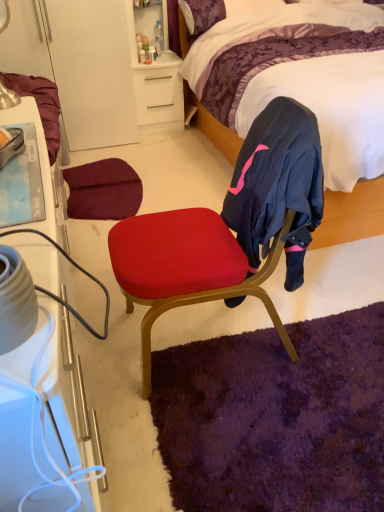
Question: Can you confirm if velvet red chair at center is thinner than white matte desk at upper center?

Choices:
 (A) yes
 (B) no

Answer: (B)

Question: Is velvet red chair at center positioned before white matte desk at upper center?

Choices:
 (A) yes
 (B) no

Answer: (A)

Question: Can you confirm if velvet red chair at center is bigger than white matte desk at upper center?

Choices:
 (A) no
 (B) yes

Answer: (B)

Question: Is velvet red chair at center smaller than white matte desk at upper center?

Choices:
 (A) no
 (B) yes

Answer: (A)

Question: Is white matte desk at upper center located within velvet red chair at center?

Choices:
 (A) yes
 (B) no

Answer: (B)

Question: Considering the positions of white plastic cabinet at left and brushed metal table lamp at upper left in the image, is white plastic cabinet at left taller or shorter than brushed metal table lamp at upper left?

Choices:
 (A) short
 (B) tall

Answer: (B)

Question: From the image's perspective, is white plastic cabinet at left located above or below brushed metal table lamp at upper left?

Choices:
 (A) below
 (B) above

Answer: (A)

Question: Would you say white plastic cabinet at left is to the left or to the right of brushed metal table lamp at upper left in the picture?

Choices:
 (A) right
 (B) left

Answer: (A)

Question: Based on their sizes in the image, would you say white plastic cabinet at left is bigger or smaller than brushed metal table lamp at upper left?

Choices:
 (A) small
 (B) big

Answer: (B)

Question: Looking at their shapes, would you say purple shag rug at lower center is wider or thinner than white plastic cabinet at left?

Choices:
 (A) thin
 (B) wide

Answer: (B)

Question: In terms of height, does purple shag rug at lower center look taller or shorter compared to white plastic cabinet at left?

Choices:
 (A) tall
 (B) short

Answer: (B)

Question: Considering the relative positions of purple shag rug at lower center and white plastic cabinet at left in the image provided, is purple shag rug at lower center to the left or to the right of white plastic cabinet at left?

Choices:
 (A) right
 (B) left

Answer: (A)

Question: From a real-world perspective, is purple shag rug at lower center above or below white plastic cabinet at left?

Choices:
 (A) below
 (B) above

Answer: (A)

Question: Is purple shag rug at lower center to the left or to the right of brushed metal table lamp at upper left in the image?

Choices:
 (A) left
 (B) right

Answer: (B)

Question: Is purple shag rug at lower center taller or shorter than brushed metal table lamp at upper left?

Choices:
 (A) short
 (B) tall

Answer: (A)